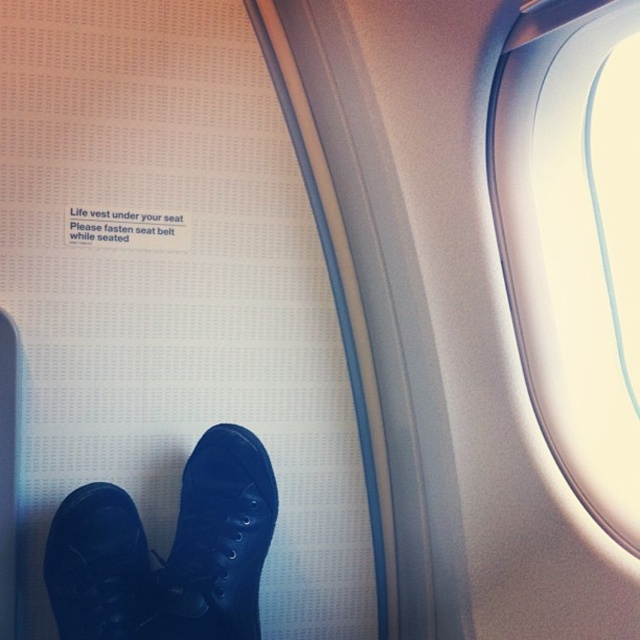
You are a passenger on an airplane and want to check the view outside. You see the transparent glass airplane window at upper right and the black leather shoe at lower left. Which object is larger in size?

The transparent glass airplane window at upper right is bigger than the black leather shoe at lower left according to the description.

You are sitting in an airplane seat and want to look outside through the transparent glass airplane window at upper right. Where should you move your head relative to the black leather shoe at lower left?

You should move your head to the right side relative to the black leather shoe at lower left because the transparent glass airplane window at upper right is located to the right of the black leather shoe at lower left.